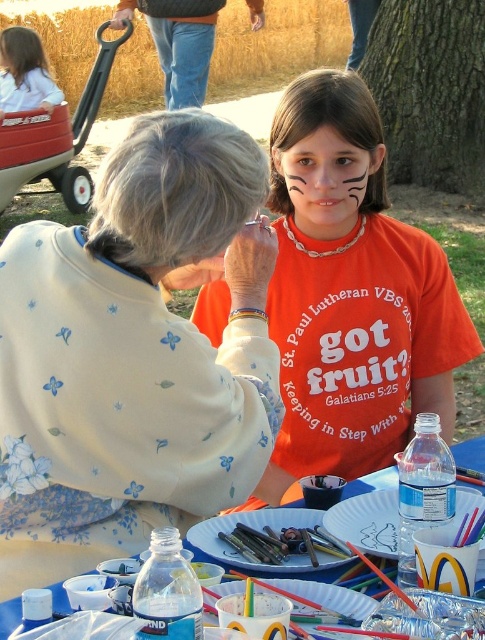
You are a photographer trying to capture the scene of the woman painting the girl. You notice the white paper plate at lower center and the smooth white shirt at upper left. Which object should you focus on first if you want to include both in your shot without moving the camera?

The white paper plate at lower center should be focused on first because it is smaller in height compared to the smooth white shirt at upper left, allowing the photographer to frame both objects effectively.

You are a photographer at the event and need to capture a photo that includes both the white paper plate at center and the translucent plastic bottle at lower center. Based on their positions, which object should be placed on the left side of the photo frame to ensure both are visible?

The white paper plate at center should be placed on the left side of the photo frame because it is already positioned on the left side of the translucent plastic bottle at lower center, so arranging them this way will maintain their natural spatial relationship and ensure both are visible in the photo.

You are a photographer trying to capture a candid shot of the scene. You notice the white paper plate at lower center and the smooth white shirt at upper left. Which object should you adjust your camera focus to first to ensure both are in the frame?

The white paper plate at lower center is in front of the smooth white shirt at upper left, so you should focus on the white paper plate at lower center first to ensure both are in the frame.